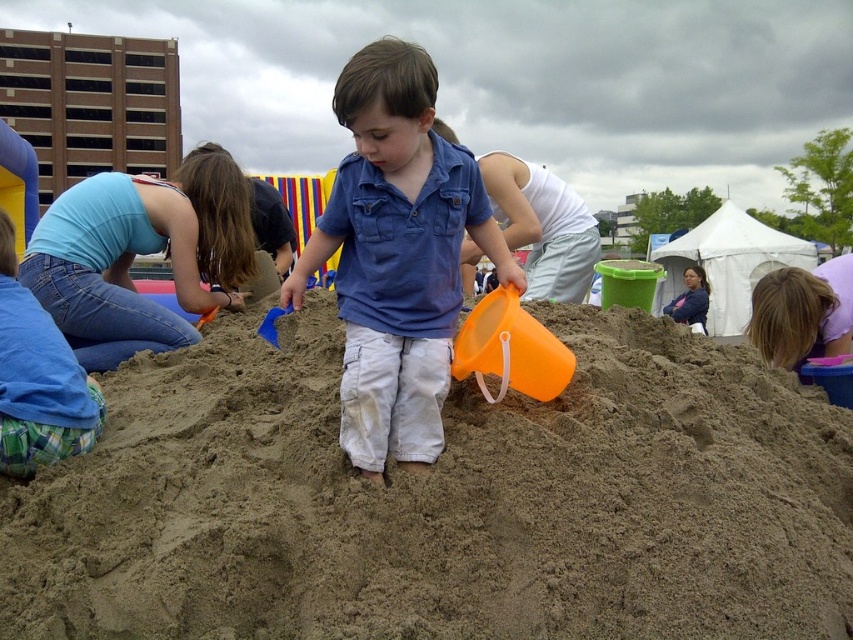
You are a photographer at the event and want to capture a photo of the blue denim shirt at center and the smooth sand mound at center. Which object should you focus on first if you want to include both in the frame?

The smooth sand mound at center is bigger than blue denim shirt at center, so you should focus on the smooth sand mound at center first to ensure it fits properly in the frame.